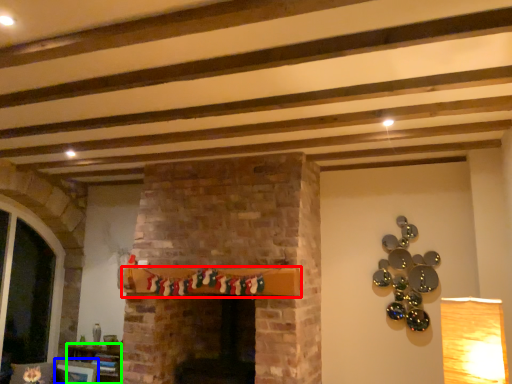
Question: Which object is positioned closest to shelf (highlighted by a red box)? Select from picture frame (highlighted by a blue box) and furniture (highlighted by a green box).

Choices:
 (A) picture frame
 (B) furniture

Answer: (B)